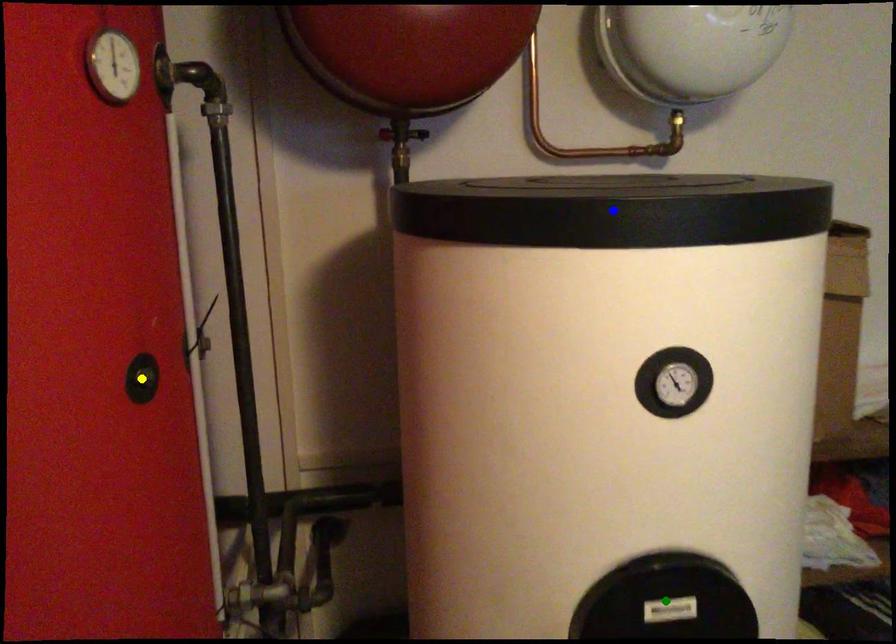
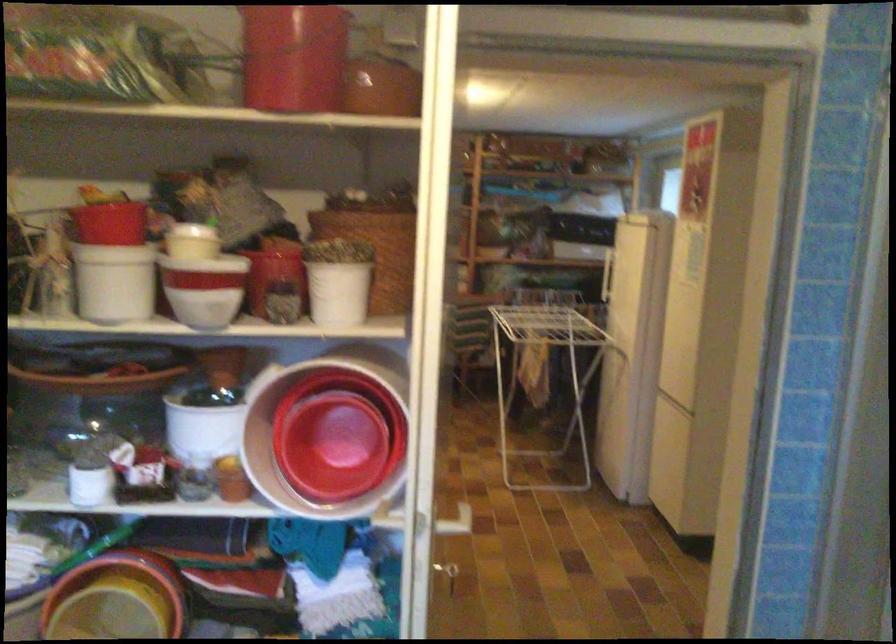
I am providing you with two images of the same scene from different viewpoints. Three points are marked in image1. Which point corresponds to a part or object that is occluded in image2?In image1, three points are marked. Which of them correspond to a part or object that is occluded in image2?Among the three points shown in image1, which one corresponds to a part or object that is no longer visible due to occlusion in image2?

yellow point, green point, blue point